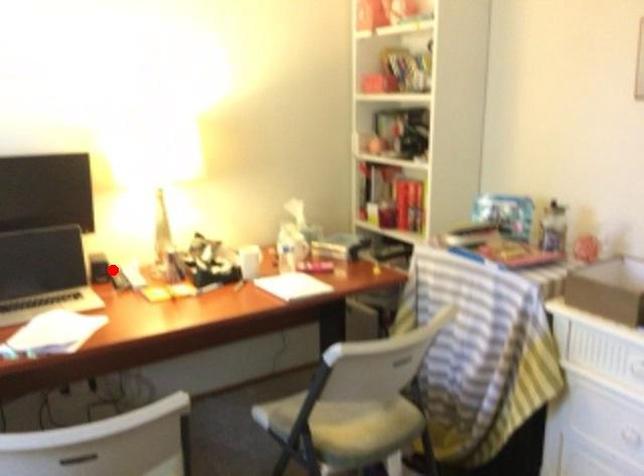
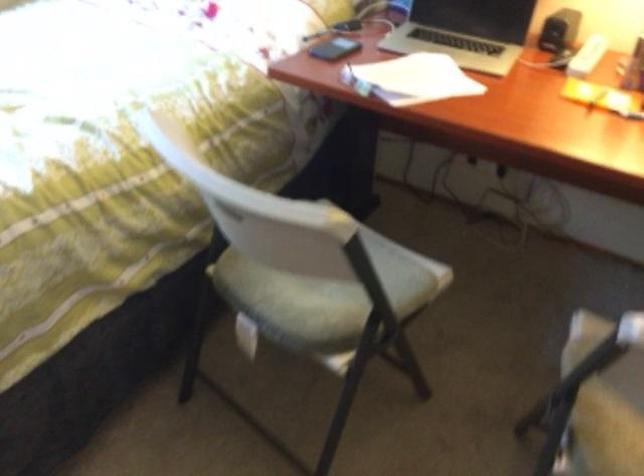
Question: A red point is marked in image1. In image2, is the corresponding 3D point closer to the camera or farther? Reply with the corresponding letter.

Choices:
 (A) The corresponding 3D point is closer.
 (B) The corresponding 3D point is farther.

Answer: (A)